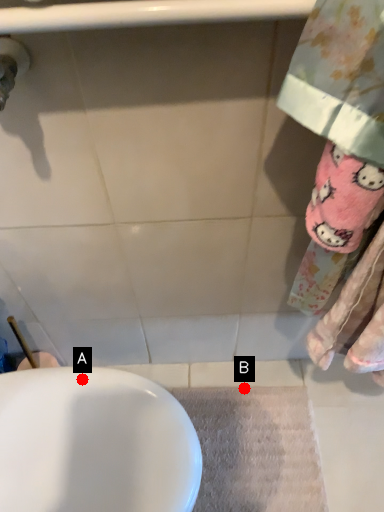
Question: Two points are circled on the image, labeled by A and B beside each circle. Which point is closer to the camera?

Choices:
 (A) A is closer
 (B) B is closer

Answer: (A)